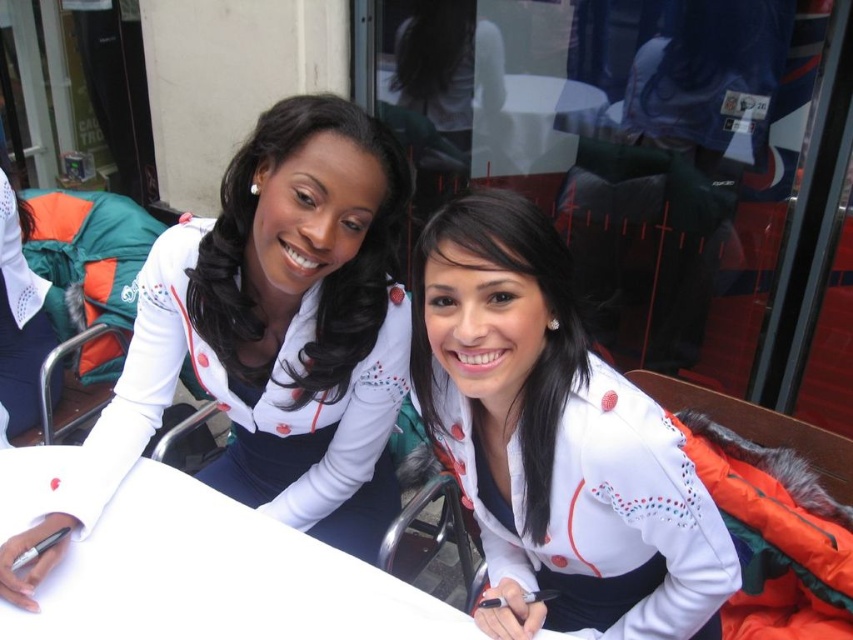
Question: Which of the following is the farthest from the observer?

Choices:
 (A) white matte jacket at upper left
 (B) white matte jacket at center
 (C) white paper at center

Answer: (A)

Question: Based on their relative distances, which object is nearer to the white matte jacket at upper left?

Choices:
 (A) white matte jacket at center
 (B) white paper at center

Answer: (B)

Question: Which point is closer to the camera?

Choices:
 (A) (183, 570)
 (B) (485, 490)

Answer: (A)

Question: Is white matte jacket at center behind white paper at center?

Choices:
 (A) no
 (B) yes

Answer: (A)

Question: Can you confirm if white matte jacket at upper left is wider than white paper at center?

Choices:
 (A) no
 (B) yes

Answer: (A)

Question: Does white matte jacket at center lie behind white paper at center?

Choices:
 (A) no
 (B) yes

Answer: (A)